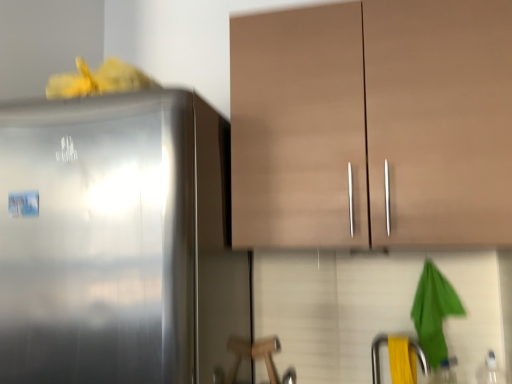
What do you see at coordinates (117, 241) in the screenshot? Image resolution: width=512 pixels, height=384 pixels. I see `satin silver refrigerator at left` at bounding box center [117, 241].

Describe the element at coordinates (373, 124) in the screenshot. The width and height of the screenshot is (512, 384). I see `matte brown cabinet at upper center` at that location.

Find the location of a particular element. The height and width of the screenshot is (384, 512). yellow rubber at lower right is located at coordinates pos(377,356).

Considering the sizes of objects matte brown cabinet at upper center and satin silver refrigerator at left in the image provided, who is taller, matte brown cabinet at upper center or satin silver refrigerator at left?

satin silver refrigerator at left is taller.

Which of these two, matte brown cabinet at upper center or satin silver refrigerator at left, is smaller?

Smaller between the two is matte brown cabinet at upper center.

From the picture: From the image's perspective, is matte brown cabinet at upper center located above or below satin silver refrigerator at left?

From the image's perspective, matte brown cabinet at upper center appears above satin silver refrigerator at left.

Is matte brown cabinet at upper center wider or thinner than satin silver refrigerator at left?

In the image, matte brown cabinet at upper center appears to be more narrow than satin silver refrigerator at left.

Is yellow rubber at lower right positioned beyond the bounds of satin silver refrigerator at left?

That's correct, yellow rubber at lower right is outside of satin silver refrigerator at left.

From the picture: Considering the sizes of objects yellow rubber at lower right and satin silver refrigerator at left in the image provided, who is wider, yellow rubber at lower right or satin silver refrigerator at left?

satin silver refrigerator at left.

Considering the positions of objects yellow rubber at lower right and satin silver refrigerator at left in the image provided, who is behind, yellow rubber at lower right or satin silver refrigerator at left?

yellow rubber at lower right.

Does point (375, 343) come closer to viewer compared to point (68, 262)?

No, (375, 343) is further to viewer.

Considering the sizes of satin silver refrigerator at left and matte brown cabinet at upper center in the image, is satin silver refrigerator at left wider or thinner than matte brown cabinet at upper center?

In the image, satin silver refrigerator at left appears to be wider than matte brown cabinet at upper center.

From the image's perspective, is satin silver refrigerator at left above matte brown cabinet at upper center?

No, from the image's perspective, satin silver refrigerator at left is not above matte brown cabinet at upper center.

The image size is (512, 384). In the image, there is a matte brown cabinet at upper center. What are the coordinates of `refrigerator below it (from a real-world perspective)` in the screenshot? It's located at (117, 241).

Considering the positions of objects satin silver refrigerator at left and yellow rubber at lower right in the image provided, who is more to the left, satin silver refrigerator at left or yellow rubber at lower right?

From the viewer's perspective, satin silver refrigerator at left appears more on the left side.

Between satin silver refrigerator at left and yellow rubber at lower right, which one has smaller width?

yellow rubber at lower right is thinner.

Considering the relative sizes of satin silver refrigerator at left and yellow rubber at lower right in the image provided, is satin silver refrigerator at left bigger than yellow rubber at lower right?

Indeed, satin silver refrigerator at left has a larger size compared to yellow rubber at lower right.

From a real-world perspective, relative to yellow rubber at lower right, is satin silver refrigerator at left vertically above or below?

satin silver refrigerator at left is situated higher than yellow rubber at lower right in the real world.

Are matte brown cabinet at upper center and yellow rubber at lower right far apart?

That's not correct — matte brown cabinet at upper center is a little close to yellow rubber at lower right.

Is matte brown cabinet at upper center looking in the opposite direction of yellow rubber at lower right?

No.

Can you confirm if matte brown cabinet at upper center is taller than yellow rubber at lower right?

Yes, matte brown cabinet at upper center is taller than yellow rubber at lower right.

From the image's perspective, which one is positioned higher, matte brown cabinet at upper center or yellow rubber at lower right?

From the image's view, matte brown cabinet at upper center is above.

Is yellow rubber at lower right inside the boundaries of matte brown cabinet at upper center, or outside?

yellow rubber at lower right is outside matte brown cabinet at upper center.

In the scene shown: Can you confirm if yellow rubber at lower right is taller than matte brown cabinet at upper center?

Incorrect, the height of yellow rubber at lower right is not larger of that of matte brown cabinet at upper center.

From the image's perspective, is yellow rubber at lower right above or below matte brown cabinet at upper center?

From the image's perspective, yellow rubber at lower right appears below matte brown cabinet at upper center.

Is there a large distance between yellow rubber at lower right and matte brown cabinet at upper center?

No, yellow rubber at lower right is not far from matte brown cabinet at upper center.

Where is `refrigerator lying in front of the matte brown cabinet at upper center`? The height and width of the screenshot is (384, 512). refrigerator lying in front of the matte brown cabinet at upper center is located at coordinates (117, 241).

Locate an element on the screen. This screenshot has width=512, height=384. faucet below the satin silver refrigerator at left (from the image's perspective) is located at coordinates (377, 356).

Based on their spatial positions, is satin silver refrigerator at left or matte brown cabinet at upper center further from yellow rubber at lower right?

satin silver refrigerator at left lies further to yellow rubber at lower right than the other object.

Considering their positions, is yellow rubber at lower right positioned closer to matte brown cabinet at upper center than satin silver refrigerator at left?

satin silver refrigerator at left is closer to matte brown cabinet at upper center.

Considering their positions, is yellow rubber at lower right positioned further to satin silver refrigerator at left than matte brown cabinet at upper center?

The object further to satin silver refrigerator at left is yellow rubber at lower right.

Looking at the image, which one is located further to satin silver refrigerator at left, matte brown cabinet at upper center or yellow rubber at lower right?

Based on the image, yellow rubber at lower right appears to be further to satin silver refrigerator at left.

Which object lies further to the anchor point yellow rubber at lower right, matte brown cabinet at upper center or satin silver refrigerator at left?

satin silver refrigerator at left is positioned further to the anchor yellow rubber at lower right.

Looking at the image, which one is located closer to matte brown cabinet at upper center, satin silver refrigerator at left or yellow rubber at lower right?

Among the two, satin silver refrigerator at left is located nearer to matte brown cabinet at upper center.

Image resolution: width=512 pixels, height=384 pixels. Identify the location of cabinetry between satin silver refrigerator at left and yellow rubber at lower right in the horizontal direction. (373, 124).